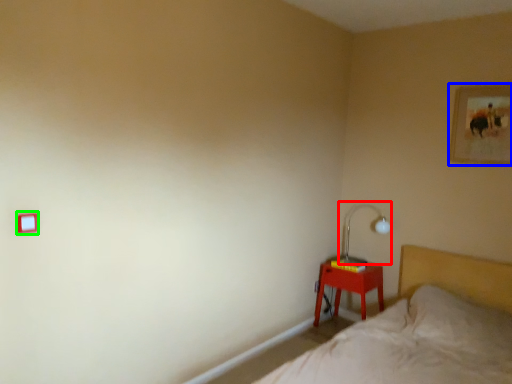
Question: Which object is the farthest from table lamp (highlighted by a red box)? Choose among these: picture frame (highlighted by a blue box) or light switch (highlighted by a green box).

Choices:
 (A) picture frame
 (B) light switch

Answer: (B)